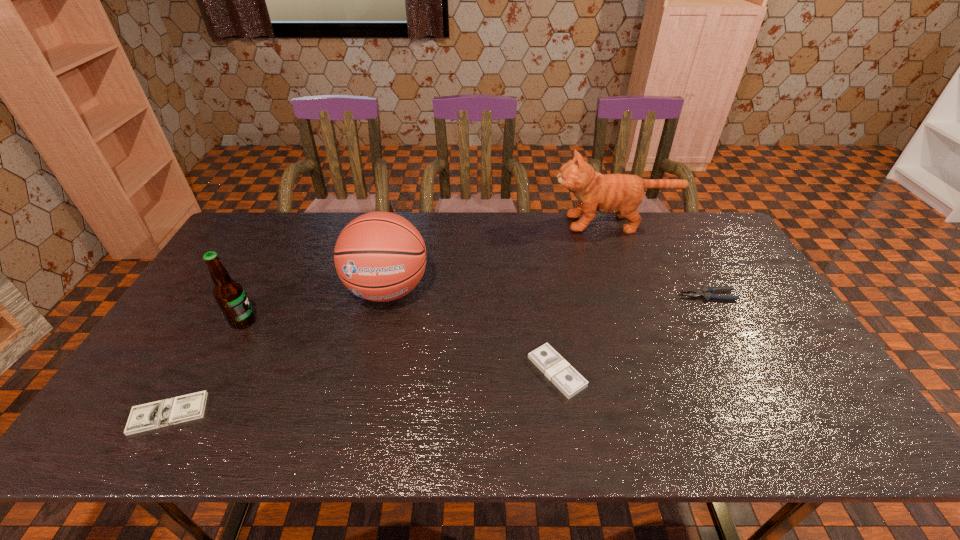
Where is `the farthest object`? The height and width of the screenshot is (540, 960). the farthest object is located at coordinates (621, 194).

Where is `the third object from left to right`? The width and height of the screenshot is (960, 540). the third object from left to right is located at coordinates (380, 256).

This screenshot has height=540, width=960. In order to click on beer bottle in this screenshot , I will do `click(229, 294)`.

Locate an element on the screen. pliers is located at coordinates (707, 293).

Locate an element on the screen. The height and width of the screenshot is (540, 960). the right dollar is located at coordinates (570, 382).

The image size is (960, 540). In order to click on the taller dollar in this screenshot , I will do `click(570, 382)`.

At what (x,y) coordinates should I click in order to perform the action: click on the left dollar. Please return your answer as a coordinate pair (x, y). This screenshot has width=960, height=540. Looking at the image, I should click on (157, 414).

In order to click on the shorter dollar in this screenshot , I will do 157,414.

You are a GUI agent. You are given a task and a screenshot of the screen. Output one action in this format:
    pyautogui.click(x=<x>, y=<y>)
    Task: Click on the vacant space located 0.180m on the face of the farthest object
    Image resolution: width=960 pixels, height=540 pixels.
    Given the screenshot: What is the action you would take?
    pyautogui.click(x=502, y=223)

This screenshot has height=540, width=960. What are the coordinates of `vacant space located on the face of the farthest object` in the screenshot? It's located at tap(455, 223).